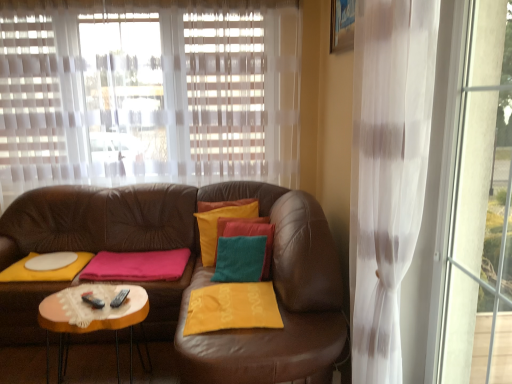
This screenshot has height=384, width=512. What do you see at coordinates (148, 92) in the screenshot?
I see `translucent white curtain at upper center` at bounding box center [148, 92].

Where is `translucent white curtain at upper center`? translucent white curtain at upper center is located at coordinates (148, 92).

At what (x,y) coordinates should I click in order to perform the action: click on leather couch at center. Please return your answer as a coordinate pair (x, y). Image resolution: width=512 pixels, height=384 pixels. Looking at the image, I should click on (202, 270).

This screenshot has width=512, height=384. Describe the element at coordinates (202, 270) in the screenshot. I see `leather couch at center` at that location.

Measure the distance between point (300, 278) and camera.

Point (300, 278) and camera are 2.23 meters apart from each other.

I want to click on translucent white curtain at upper center, so click(148, 92).

In the scene shown: Considering the relative positions of leather couch at center and translucent white curtain at upper center in the image provided, is leather couch at center to the left or to the right of translucent white curtain at upper center?

leather couch at center is to the left of translucent white curtain at upper center.

Is leather couch at center positioned in front of translucent white curtain at upper center?

That is True.

Is point (101, 205) in front of point (255, 61)?

Yes, point (101, 205) is closer to viewer.

From the image's perspective, which one is positioned lower, leather couch at center or translucent white curtain at upper center?

leather couch at center is shown below in the image.

From a real-world perspective, which is physically above, leather couch at center or translucent white curtain at upper center?

translucent white curtain at upper center, from a real-world perspective.

Which object is thinner, leather couch at center or translucent white curtain at upper center?

translucent white curtain at upper center is thinner.

Considering the sizes of objects leather couch at center and translucent white curtain at upper center in the image provided, who is shorter, leather couch at center or translucent white curtain at upper center?

translucent white curtain at upper center.

Can you confirm if leather couch at center is smaller than translucent white curtain at upper center?

Incorrect, leather couch at center is not smaller in size than translucent white curtain at upper center.

Is leather couch at center outside of translucent white curtain at upper center?

Yes, leather couch at center is not within translucent white curtain at upper center.

Is leather couch at center next to translucent white curtain at upper center and touching it?

There is a gap between leather couch at center and translucent white curtain at upper center.

Is leather couch at center facing towards translucent white curtain at upper center?

No, leather couch at center is not turned towards translucent white curtain at upper center.

You are a GUI agent. You are given a task and a screenshot of the screen. Output one action in this format:
    pyautogui.click(x=<x>, y=<y>)
    Task: Click on the studio couch below the translucent white curtain at upper center (from a real-world perspective)
    This screenshot has height=384, width=512.
    Given the screenshot: What is the action you would take?
    pyautogui.click(x=202, y=270)

Is translucent white curtain at upper center at the right side of leather couch at center?

Yes.

Based on the photo, considering the relative positions of translucent white curtain at upper center and leather couch at center in the image provided, is translucent white curtain at upper center behind leather couch at center?

Yes, translucent white curtain at upper center is further from the camera.

Which point is more distant from viewer, (273,131) or (67,230)?

Result: The point (273,131) is farther.

From the image's perspective, relative to leather couch at center, is translucent white curtain at upper center above or below?

translucent white curtain at upper center is situated higher than leather couch at center in the image.

From a real-world perspective, is translucent white curtain at upper center over leather couch at center?

Indeed, from a real-world perspective, translucent white curtain at upper center stands above leather couch at center.

Considering the sizes of translucent white curtain at upper center and leather couch at center in the image, is translucent white curtain at upper center wider or thinner than leather couch at center?

Considering their sizes, translucent white curtain at upper center looks slimmer than leather couch at center.

Considering the sizes of objects translucent white curtain at upper center and leather couch at center in the image provided, who is shorter, translucent white curtain at upper center or leather couch at center?

translucent white curtain at upper center is shorter.

Who is bigger, translucent white curtain at upper center or leather couch at center?

Bigger between the two is leather couch at center.

Is translucent white curtain at upper center not within leather couch at center?

Yes, translucent white curtain at upper center is not within leather couch at center.

Are translucent white curtain at upper center and leather couch at center located far from each other?

They are positioned close to each other.

Is translucent white curtain at upper center oriented away from leather couch at center?

No, leather couch at center is not at the back of translucent white curtain at upper center.

How many degrees apart are the facing directions of translucent white curtain at upper center and leather couch at center?

0.246 degrees separate the facing orientations of translucent white curtain at upper center and leather couch at center.

Measure the distance between translucent white curtain at upper center and leather couch at center.

30.28 inches.

Locate an element on the screen. studio couch below the translucent white curtain at upper center (from the image's perspective) is located at coordinates 202,270.

In order to click on curtain that appears behind the leather couch at center in this screenshot , I will do `click(148, 92)`.

Locate an element on the screen. curtain located above the leather couch at center (from the image's perspective) is located at coordinates (148, 92).